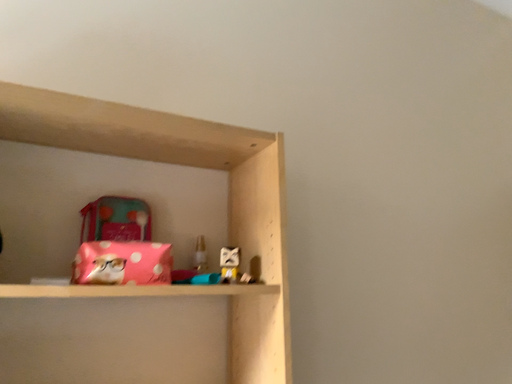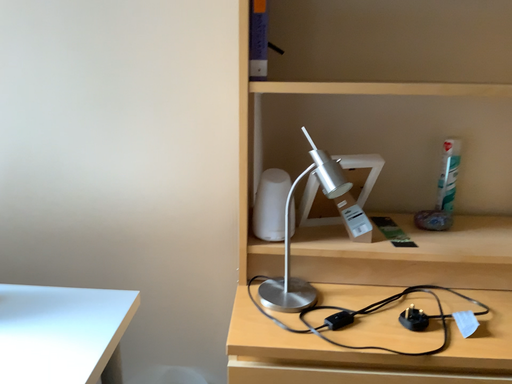
Question: Which way did the camera rotate in the video?

Choices:
 (A) rotated downward
 (B) rotated upward

Answer: (A)